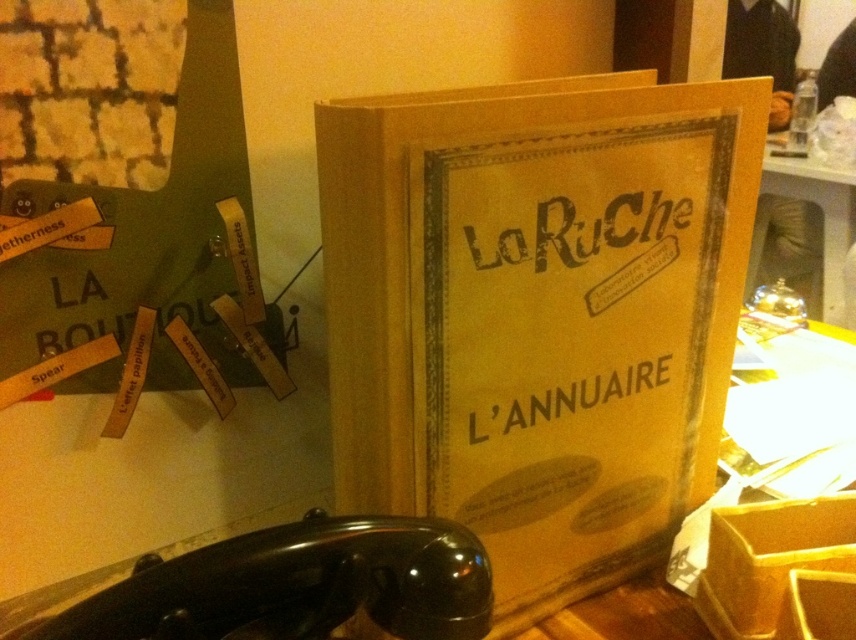
You are organizing a bookshelf and see the yellow cardboard book at center and the metallic silver bell at center. Which object is positioned to the left?

The yellow cardboard book at center is positioned to the left of the metallic silver bell at center.

You are organizing a bookshelf and need to place the yellow cardboard book at center and the metallic silver bell at center. Since the bookshelf has limited space, which object should you place first if you want to prioritize the larger item?

The yellow cardboard book at center should be placed first because it has a larger size compared to the metallic silver bell at center, ensuring it fits properly on the bookshelf.

You are standing in front of the vintage book and the green poster. You notice two points marked on the image. Which point, point [345,301] or point [801,163], is nearer to you?

Point [345,301] is closer to the camera than point [801,163].